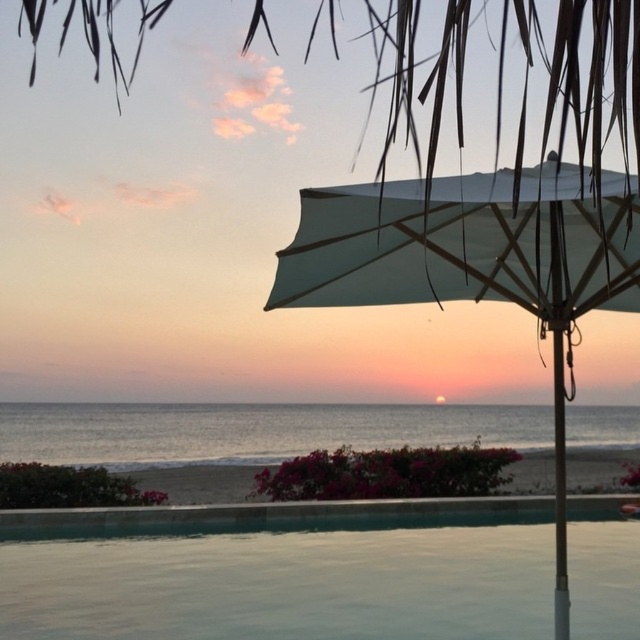
Question: Is smooth glass pool at lower center wider than white fabric umbrella at right?

Choices:
 (A) no
 (B) yes

Answer: (B)

Question: Does smooth glass pool at lower center have a greater width compared to white fabric umbrella at right?

Choices:
 (A) no
 (B) yes

Answer: (B)

Question: Which object appears closest to the camera in this image?

Choices:
 (A) white fabric umbrella at right
 (B) smooth glass pool at lower center

Answer: (A)

Question: Is smooth glass pool at lower center above white fabric umbrella at right?

Choices:
 (A) yes
 (B) no

Answer: (B)

Question: Which object appears closest to the camera in this image?

Choices:
 (A) white fabric umbrella at right
 (B) smooth glass pool at lower center

Answer: (A)

Question: Among these objects, which one is nearest to the camera?

Choices:
 (A) white fabric umbrella at right
 (B) smooth glass pool at lower center

Answer: (A)